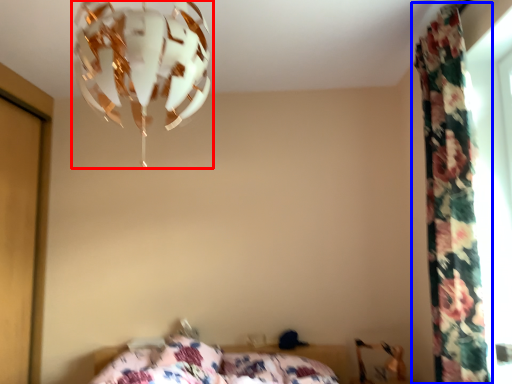
Question: Which object is further to the camera taking this photo, lamp (highlighted by a red box) or curtain (highlighted by a blue box)?

Choices:
 (A) lamp
 (B) curtain

Answer: (B)